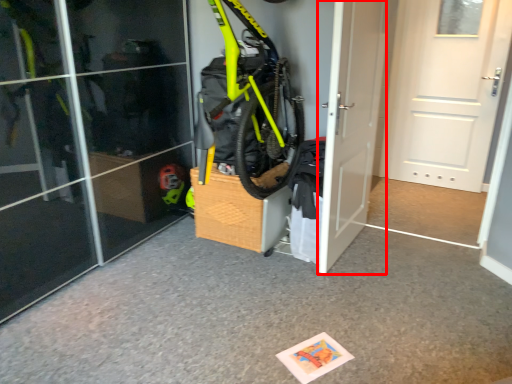
Question: From the image's perspective, considering the relative positions of door (annotated by the red box) and door in the image provided, where is door (annotated by the red box) located with respect to the staircase?

Choices:
 (A) below
 (B) above

Answer: (A)